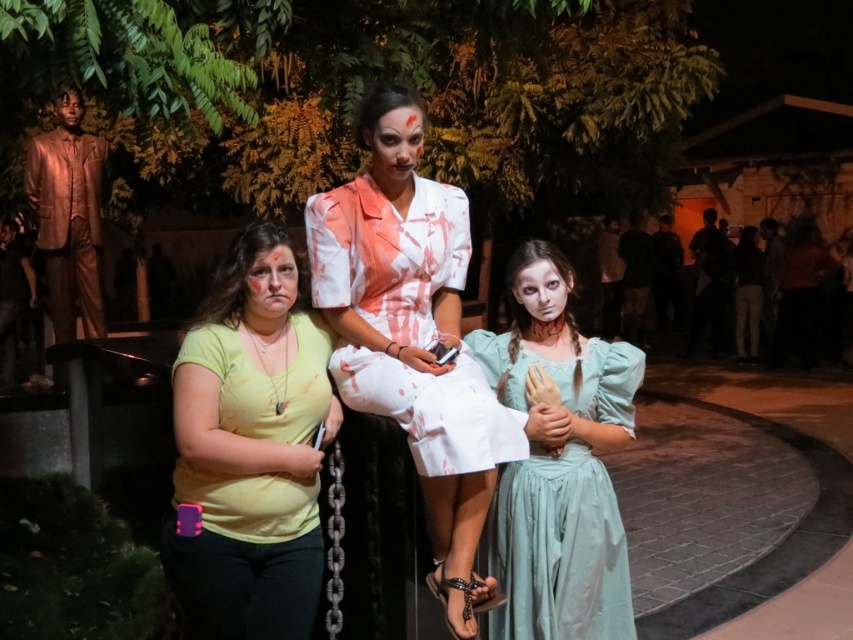
Is white fabric dress at center further to the viewer compared to light blue satin dress at center?

No, white fabric dress at center is in front of light blue satin dress at center.

Can you confirm if white fabric dress at center is smaller than light blue satin dress at center?

Actually, white fabric dress at center might be larger than light blue satin dress at center.

Locate an element on the screen. Image resolution: width=853 pixels, height=640 pixels. white fabric dress at center is located at coordinates (413, 337).

Is yellow matte shirt at center positioned in front of light blue satin dress at center?

Yes.

Which is more to the right, yellow matte shirt at center or light blue satin dress at center?

From the viewer's perspective, light blue satin dress at center appears more on the right side.

Which is in front, point (251, 515) or point (486, 356)?

Point (251, 515) is more forward.

I want to click on yellow matte shirt at center, so point(248,451).

From the picture: Can you confirm if white fabric dress at center is positioned above yellow matte shirt at center?

Yes, white fabric dress at center is above yellow matte shirt at center.

Which of these two, white fabric dress at center or yellow matte shirt at center, stands shorter?

With less height is yellow matte shirt at center.

Which is behind, point (436, 232) or point (225, 390)?

Point (436, 232)

Locate an element on the screen. The height and width of the screenshot is (640, 853). white fabric dress at center is located at coordinates (413, 337).